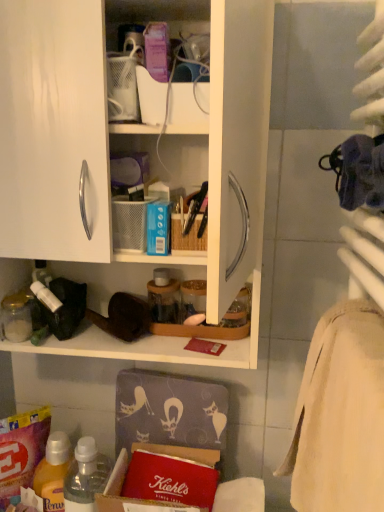
Question: Can you confirm if beige cotton bath towel at right is taller than translucent plastic bottle at lower left?

Choices:
 (A) no
 (B) yes

Answer: (B)

Question: Considering the relative sizes of beige cotton bath towel at right and translucent plastic bottle at lower left in the image provided, is beige cotton bath towel at right shorter than translucent plastic bottle at lower left?

Choices:
 (A) yes
 (B) no

Answer: (B)

Question: Considering the relative sizes of beige cotton bath towel at right and translucent plastic bottle at lower left in the image provided, is beige cotton bath towel at right thinner than translucent plastic bottle at lower left?

Choices:
 (A) yes
 (B) no

Answer: (B)

Question: Are beige cotton bath towel at right and translucent plastic bottle at lower left beside each other?

Choices:
 (A) no
 (B) yes

Answer: (A)

Question: From a real-world perspective, is beige cotton bath towel at right on top of translucent plastic bottle at lower left?

Choices:
 (A) no
 (B) yes

Answer: (B)

Question: From a real-world perspective, is matte plastic container at upper center above or below beige cotton bath towel at right?

Choices:
 (A) above
 (B) below

Answer: (A)

Question: Is matte plastic container at upper center in front of or behind beige cotton bath towel at right in the image?

Choices:
 (A) front
 (B) behind

Answer: (B)

Question: In the image, is matte plastic container at upper center on the left side or the right side of beige cotton bath towel at right?

Choices:
 (A) left
 (B) right

Answer: (A)

Question: Considering the positions of matte plastic container at upper center and beige cotton bath towel at right in the image, is matte plastic container at upper center wider or thinner than beige cotton bath towel at right?

Choices:
 (A) wide
 (B) thin

Answer: (B)

Question: From the image's perspective, relative to white matte cabinet at upper left, is beige cotton bath towel at right above or below?

Choices:
 (A) above
 (B) below

Answer: (B)

Question: In terms of size, does beige cotton bath towel at right appear bigger or smaller than white matte cabinet at upper left?

Choices:
 (A) small
 (B) big

Answer: (A)

Question: From a real-world perspective, is beige cotton bath towel at right above or below white matte cabinet at upper left?

Choices:
 (A) above
 (B) below

Answer: (B)

Question: Is point (309, 364) positioned closer to the camera than point (97, 154)?

Choices:
 (A) closer
 (B) farther

Answer: (B)

Question: From a real-world perspective, relative to matte plastic container at upper center, is beige cotton bath towel at right vertically above or below?

Choices:
 (A) below
 (B) above

Answer: (A)

Question: Considering the positions of beige cotton bath towel at right and matte plastic container at upper center in the image, is beige cotton bath towel at right bigger or smaller than matte plastic container at upper center?

Choices:
 (A) big
 (B) small

Answer: (A)